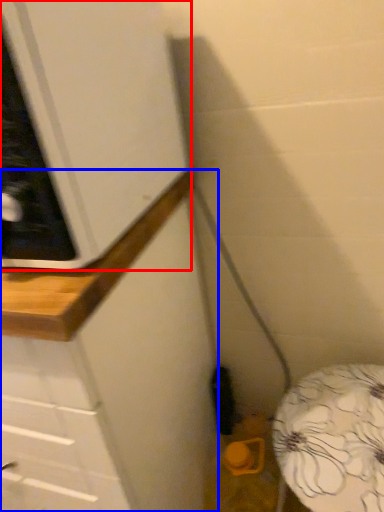
Question: Which object is further to the camera taking this photo, cabinetry (highlighted by a red box) or counter (highlighted by a blue box)?

Choices:
 (A) cabinetry
 (B) counter

Answer: (B)